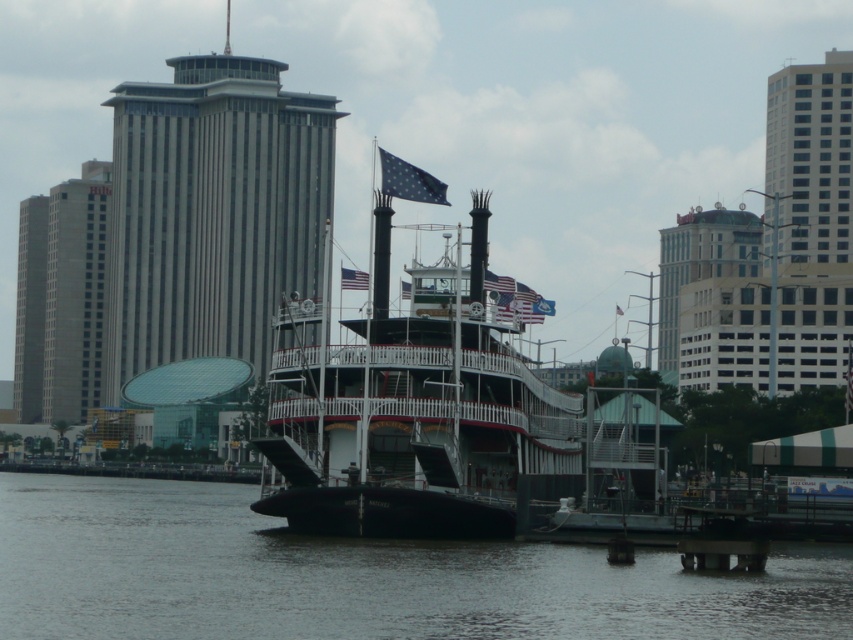
Based on the photo, you are standing on the waterfront and see the polished wood steamboat at center and the american flag at center. Which object is positioned more to the right side of the scene?

The polished wood steamboat at center is positioned more to the right side of the scene compared to the american flag at center.

You are a tour guide preparing to board passengers onto the polished wood steamboat at center. The gangway you use to board passengers is currently placed on the smooth concrete dock at lower center. To ensure safety, the gangway must be at least 20 meters long to reach the boat. Is the current gangway long enough?

The distance between the polished wood steamboat at center and the smooth concrete dock at lower center is 19.70 meters. Since the required gangway length is 20 meters, the current gangway is not long enough to safely reach the boat.

Based on the photo, you are a tourist standing on the dock where the paddlewheel steamboat is moored. You want to take a photo that includes both the glassy steel skyscraper at upper right and the green glass building at upper center. Which building should you position to your left to include both in the frame?

To include both the glassy steel skyscraper at upper right and the green glass building at upper center in your photo, position the green glass building at upper center to your left since the glassy steel skyscraper at upper right is located to its right.